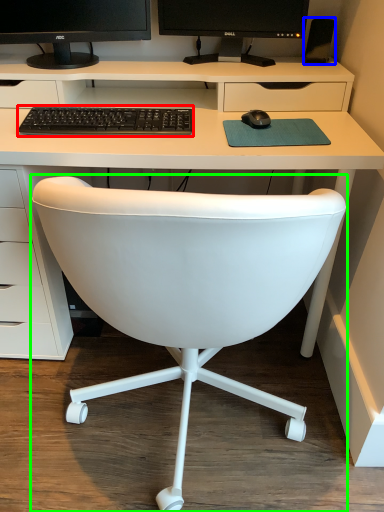
Question: Based on their relative distances, which object is farther from computer keyboard (highlighted by a red box)? Choose from speaker (highlighted by a blue box) and chair (highlighted by a green box).

Choices:
 (A) speaker
 (B) chair

Answer: (A)